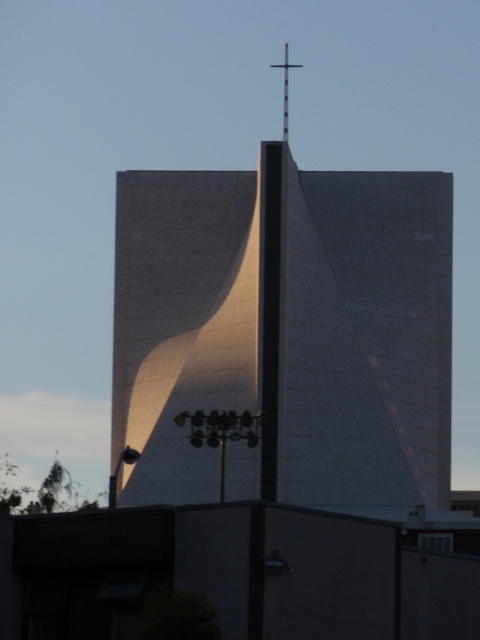
Question: Is white smooth tower at center bigger than black metal cross at upper center?

Choices:
 (A) no
 (B) yes

Answer: (B)

Question: Is white smooth tower at center thinner than black metal cross at upper center?

Choices:
 (A) yes
 (B) no

Answer: (B)

Question: Among these objects, which one is farthest from the camera?

Choices:
 (A) white smooth tower at center
 (B) black metal cross at upper center

Answer: (B)

Question: Is white smooth tower at center closer to the viewer compared to black metal cross at upper center?

Choices:
 (A) no
 (B) yes

Answer: (B)

Question: Among these points, which one is farthest from the camera?

Choices:
 (A) (437, 433)
 (B) (287, 136)

Answer: (B)